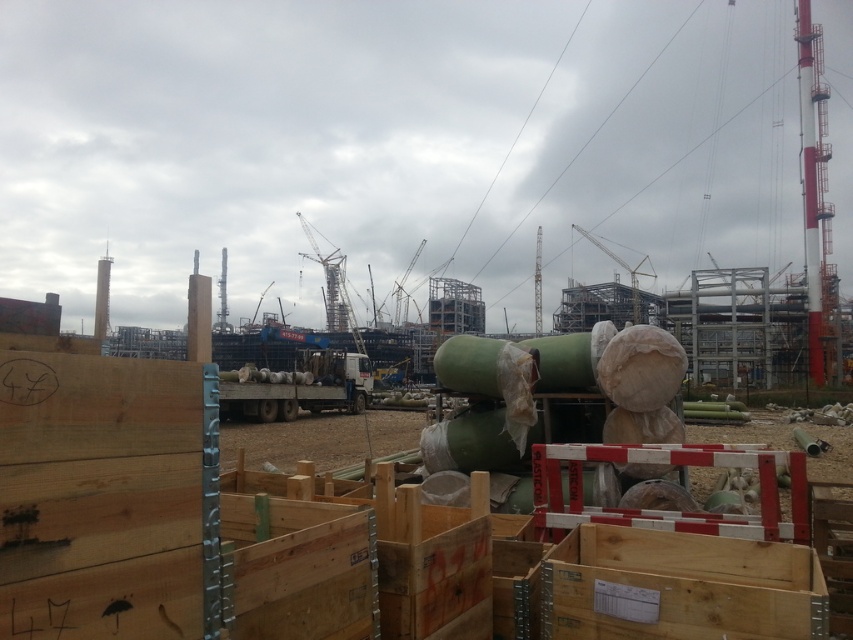
Between point (288, 394) and point (639, 316), which one is positioned behind?

The point (639, 316) is behind.

Does white matte trailer truck at center have a greater width compared to metallic gray crane at center?

In fact, white matte trailer truck at center might be narrower than metallic gray crane at center.

Is point (308, 396) less distant than point (642, 262)?

Yes.

The width and height of the screenshot is (853, 640). I want to click on white matte trailer truck at center, so pos(299,387).